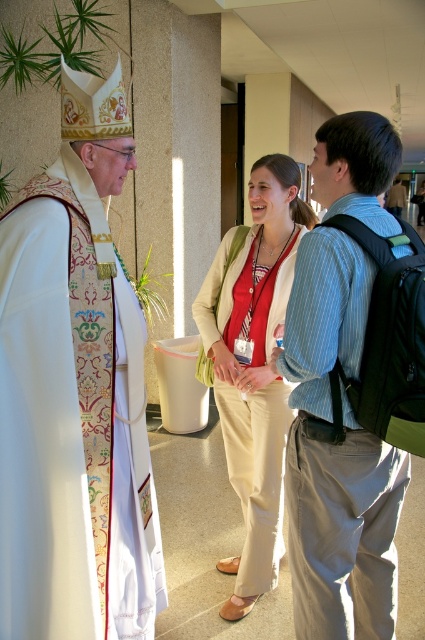
Looking at this image, between embroidered silk robe at left and striped cotton shirt at center, which one is positioned lower?

Positioned lower is embroidered silk robe at left.

Does embroidered silk robe at left have a lesser height compared to striped cotton shirt at center?

Yes, embroidered silk robe at left is shorter than striped cotton shirt at center.

The image size is (425, 640). Identify the location of embroidered silk robe at left. (67, 435).

Who is more forward, (382, 476) or (255, 573)?

Point (382, 476) is more forward.

Does striped cotton shirt at center appear on the right side of beige cotton pants at center?

Yes, striped cotton shirt at center is to the right of beige cotton pants at center.

Find the location of a particular element. This screenshot has height=640, width=425. striped cotton shirt at center is located at coordinates tap(340, 401).

Image resolution: width=425 pixels, height=640 pixels. What are the coordinates of `striped cotton shirt at center` in the screenshot? It's located at (340, 401).

Which is in front, point (102, 545) or point (220, 404)?

Point (102, 545) is in front.

Is embroidered silk robe at left wider than beige cotton pants at center?

No, embroidered silk robe at left is not wider than beige cotton pants at center.

Which is behind, point (112, 612) or point (240, 294)?

The point (240, 294) is behind.

Identify the location of embroidered silk robe at left. (67, 435).